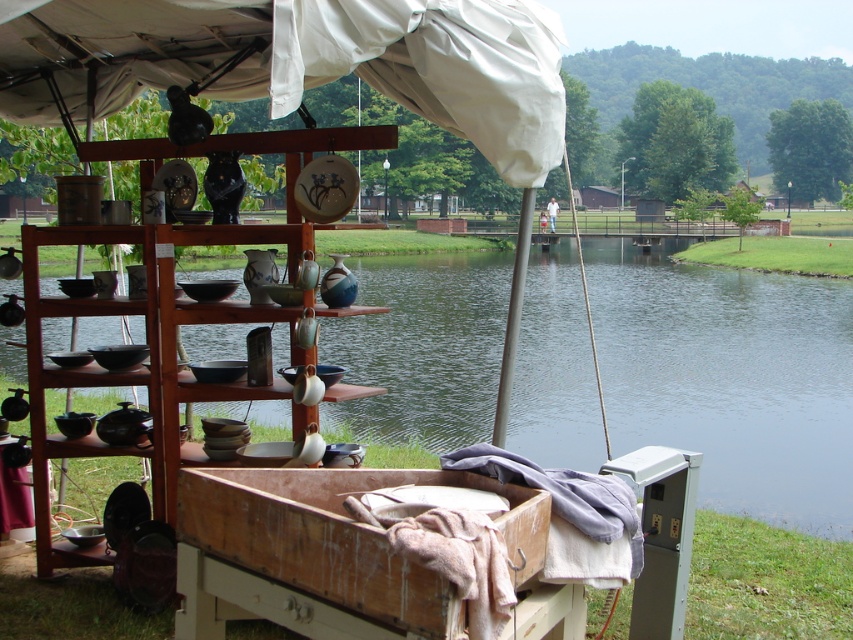
You are a delivery person carrying a large package that is 2 meters wide. You need to move from the wooden shelves at center to the smooth water at center. Is there enough space between them for you to pass through with your package?

The smooth water at center and wooden shelves at center are 17.67 meters apart, so yes, there is enough space between them for you to pass through with your 2 meter wide package.

You are standing at the edge of the water and see the point marked at coordinate (730, 378). Based on the scene description, what type of surface is located at that point?

The point at coordinate (730, 378) is on smooth water at center.

You are a customer at the pottery display and want to take a photo of both the smooth water at center and the wooden shelves at center. Which object should you place on the left side of your camera frame to include both in the photo?

To include both the smooth water at center and the wooden shelves at center in your photo, you should place the smooth water at center on the left side of your camera frame since it is already positioned on the left side of the wooden shelves at center.